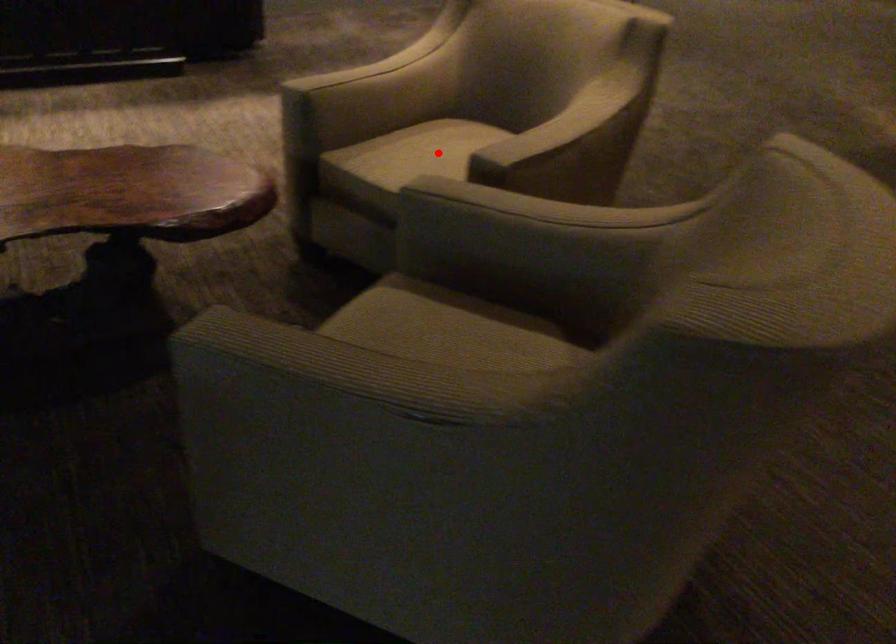
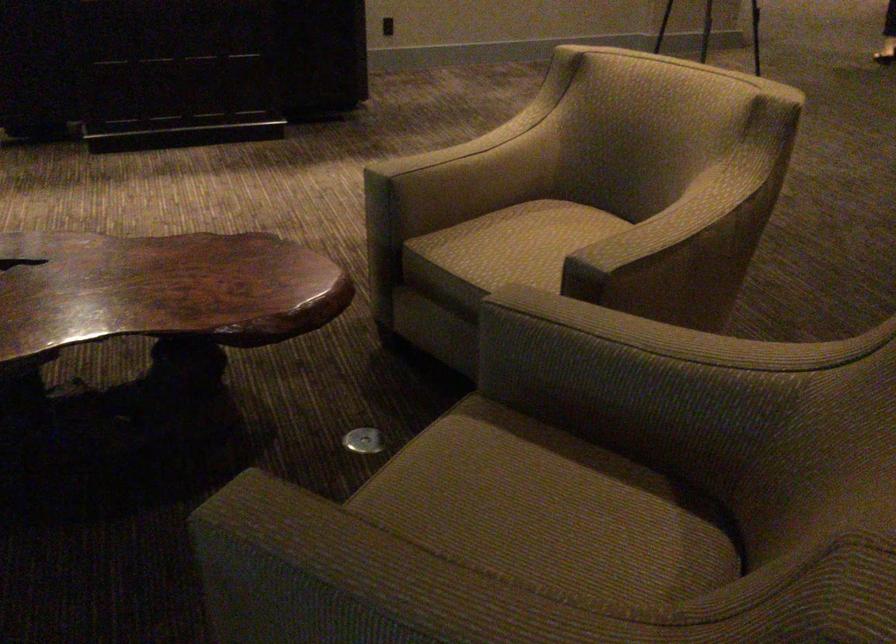
In the second image, find the point that corresponds to the highlighted location in the first image.

(535, 242)